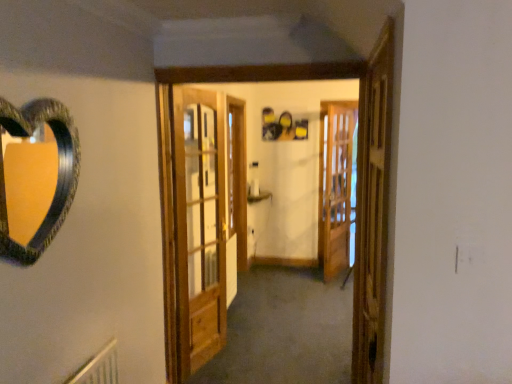
This screenshot has width=512, height=384. Describe the element at coordinates (199, 224) in the screenshot. I see `wooden barn door at center` at that location.

The image size is (512, 384). What do you see at coordinates (260, 73) in the screenshot?
I see `wooden door at center` at bounding box center [260, 73].

Measure the distance between wooden screen door at right, the 2th screen door from the right, and camera.

wooden screen door at right, the 2th screen door from the right, is 1.34 meters away from camera.

Locate an element on the screen. This screenshot has height=384, width=512. wooden barn door at center is located at coordinates (199, 224).

Who is smaller, wooden door at center or wooden screen door at right, which is the second screen door from back to front?

With smaller size is wooden screen door at right, which is the second screen door from back to front.

From a real-world perspective, is wooden door at center positioned under wooden screen door at right, positioned as the 1th screen door in front-to-back order, based on gravity?

Indeed, from a real-world perspective, wooden door at center is positioned beneath wooden screen door at right, positioned as the 1th screen door in front-to-back order.

Which is behind, point (159, 115) or point (379, 148)?

The point (159, 115) is farther.

Between wooden screen door at right, the first screen door when ordered from left to right, and wooden screen door at center, the first screen door positioned from the back, which one is positioned in front?

wooden screen door at right, the first screen door when ordered from left to right, is closer to the camera.

Which object is wider, wooden screen door at right, which is the second screen door from back to front, or wooden screen door at center, acting as the 2th screen door starting from the left?

wooden screen door at right, which is the second screen door from back to front.

Is wooden screen door at right, which is the second screen door from back to front, not near wooden screen door at center, the first screen door positioned from the back?

Yes, wooden screen door at right, which is the second screen door from back to front, is far from wooden screen door at center, the first screen door positioned from the back.

Considering the relative positions of wooden screen door at center, marked as the second screen door in a front-to-back arrangement, and wooden door at center in the image provided, is wooden screen door at center, marked as the second screen door in a front-to-back arrangement, to the left or to the right of wooden door at center?

wooden screen door at center, marked as the second screen door in a front-to-back arrangement, is positioned on wooden door at center's right side.

The width and height of the screenshot is (512, 384). I want to click on window frame that is below the wooden screen door at center, marked as the second screen door in a front-to-back arrangement (from the image's perspective), so click(x=260, y=73).

Which of these two, wooden screen door at center, marked as the second screen door in a front-to-back arrangement, or wooden door at center, is wider?

wooden door at center.

Would you say wooden screen door at center, which is the 1th screen door in right-to-left order, is inside or outside wooden screen door at right, positioned as the 1th screen door in front-to-back order?

The correct answer is: outside.

Is wooden screen door at center, acting as the 2th screen door starting from the left, thinner than wooden screen door at right, positioned as the 1th screen door in front-to-back order?

Yes, wooden screen door at center, acting as the 2th screen door starting from the left, is thinner than wooden screen door at right, positioned as the 1th screen door in front-to-back order.

How different are the orientations of wooden screen door at center, acting as the 2th screen door starting from the left, and wooden screen door at right, the first screen door when ordered from left to right, in degrees?

wooden screen door at center, acting as the 2th screen door starting from the left, and wooden screen door at right, the first screen door when ordered from left to right, are facing 137 degrees away from each other.

Locate an element on the screen. screen door on the right of wooden screen door at right, the first screen door when ordered from left to right is located at coordinates (335, 185).

Which is more to the left, wooden barn door at center or wooden door at center?

wooden barn door at center.

Does wooden barn door at center have a lesser width compared to wooden door at center?

Indeed, wooden barn door at center has a lesser width compared to wooden door at center.

Can you confirm if wooden barn door at center is shorter than wooden door at center?

Yes.

Does point (174, 141) appear closer or farther from the camera than point (163, 237)?

Clearly, point (174, 141) is more distant from the camera than point (163, 237).

From the image's perspective, is wooden door at center below wooden screen door at center, marked as the second screen door in a front-to-back arrangement?

Yes.

Is wooden door at center directly adjacent to wooden screen door at center, acting as the 2th screen door starting from the left?

No, wooden door at center is not making contact with wooden screen door at center, acting as the 2th screen door starting from the left.

Is wooden door at center to the left of wooden screen door at center, acting as the 2th screen door starting from the left, from the viewer's perspective?

Indeed, wooden door at center is positioned on the left side of wooden screen door at center, acting as the 2th screen door starting from the left.

How distant is wooden door at center from wooden screen door at center, which is the 1th screen door in right-to-left order?

They are 2.67 meters apart.

I want to click on barn door above the wooden screen door at right, which is the second screen door from back to front (from the image's perspective), so (199, 224).

Considering the relative sizes of wooden barn door at center and wooden screen door at right, positioned as the 1th screen door in front-to-back order, in the image provided, is wooden barn door at center wider than wooden screen door at right, positioned as the 1th screen door in front-to-back order,?

Yes.

Is wooden barn door at center not within wooden screen door at right, the 2th screen door from the right?

Indeed, wooden barn door at center is completely outside wooden screen door at right, the 2th screen door from the right.

Is wooden barn door at center facing away from wooden screen door at right, the first screen door when ordered from left to right?

wooden barn door at center is not turned away from wooden screen door at right, the first screen door when ordered from left to right.

Identify the location of window frame above the wooden screen door at right, positioned as the 1th screen door in front-to-back order (from the image's perspective). pyautogui.click(x=260, y=73).

Image resolution: width=512 pixels, height=384 pixels. I want to click on screen door that is below the wooden screen door at center, marked as the second screen door in a front-to-back arrangement (from the image's perspective), so click(x=372, y=210).

Looking at the image, which one is located further to wooden barn door at center, wooden screen door at right, the 2th screen door from the right, or wooden screen door at center, marked as the second screen door in a front-to-back arrangement?

The object further to wooden barn door at center is wooden screen door at center, marked as the second screen door in a front-to-back arrangement.

From the image, which object appears to be nearer to wooden screen door at center, which is the 1th screen door in right-to-left order, wooden door at center or wooden screen door at right, the 2th screen door from the right?

wooden door at center.

Looking at the image, which one is located further to wooden door at center, wooden screen door at center, the first screen door positioned from the back, or wooden barn door at center?

Based on the image, wooden screen door at center, the first screen door positioned from the back, appears to be further to wooden door at center.

From the image, which object appears to be farther from wooden door at center, wooden screen door at right, positioned as the 1th screen door in front-to-back order, or wooden barn door at center?

wooden screen door at right, positioned as the 1th screen door in front-to-back order, is further to wooden door at center.

From the image, which object appears to be farther from wooden barn door at center, wooden door at center or wooden screen door at center, acting as the 2th screen door starting from the left?

Based on the image, wooden screen door at center, acting as the 2th screen door starting from the left, appears to be further to wooden barn door at center.

From the image, which object appears to be nearer to wooden screen door at center, acting as the 2th screen door starting from the left, wooden door at center or wooden barn door at center?

Among the two, wooden barn door at center is located nearer to wooden screen door at center, acting as the 2th screen door starting from the left.

From the image, which object appears to be farther from wooden barn door at center, wooden screen door at center, which is the 1th screen door in right-to-left order, or wooden door at center?

wooden screen door at center, which is the 1th screen door in right-to-left order, is positioned further to the anchor wooden barn door at center.

Considering their positions, is wooden barn door at center positioned closer to wooden screen door at right, the 2th screen door from the right, than wooden door at center?

wooden door at center.

Locate an element on the screen. This screenshot has height=384, width=512. window frame between wooden screen door at right, the 2th screen door from the right, and wooden screen door at center, marked as the second screen door in a front-to-back arrangement, in the front-back direction is located at coordinates point(260,73).

Where is `barn door between wooden screen door at right, which is the second screen door from back to front, and wooden screen door at center, marked as the second screen door in a front-to-back arrangement, in the front-back direction`? The width and height of the screenshot is (512, 384). barn door between wooden screen door at right, which is the second screen door from back to front, and wooden screen door at center, marked as the second screen door in a front-to-back arrangement, in the front-back direction is located at coordinates (199, 224).

What are the coordinates of `window frame located between wooden screen door at right, the 2th screen door from the right, and wooden barn door at center in the depth direction` in the screenshot? It's located at (260, 73).

You are a GUI agent. You are given a task and a screenshot of the screen. Output one action in this format:
    pyautogui.click(x=<x>, y=<y>)
    Task: Click on the barn door positioned between wooden door at center and wooden screen door at center, acting as the 2th screen door starting from the left, from near to far
    Image resolution: width=512 pixels, height=384 pixels.
    Given the screenshot: What is the action you would take?
    pyautogui.click(x=199, y=224)